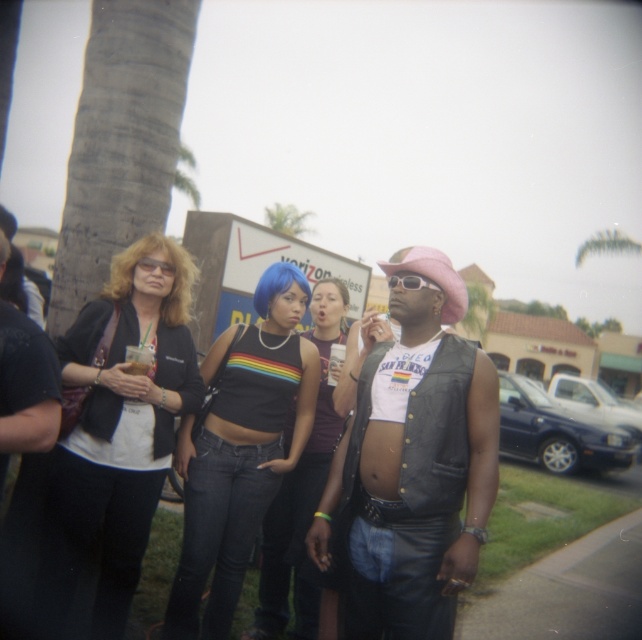
You are a fashion designer observing the image. You need to determine if the two garments, the leather vest at center and the rainbow striped tank top at center, can be displayed side by side in a store window that has a 30 inch wide display space. Can they fit without overlapping?

The distance between the leather vest at center and rainbow striped tank top at center is 30.19 inches. Since the display space is only 30 inches wide, they cannot fit side by side without overlapping.

From the picture: You are a fashion designer observing the two outfits at the gathering. The leather vest at center and the rainbow striped tank top at center are both worn by different people. Which of these two outfits takes up more space visually?

The leather vest at center is bigger than the rainbow striped tank top at center, so the leather vest at center takes up more visual space.